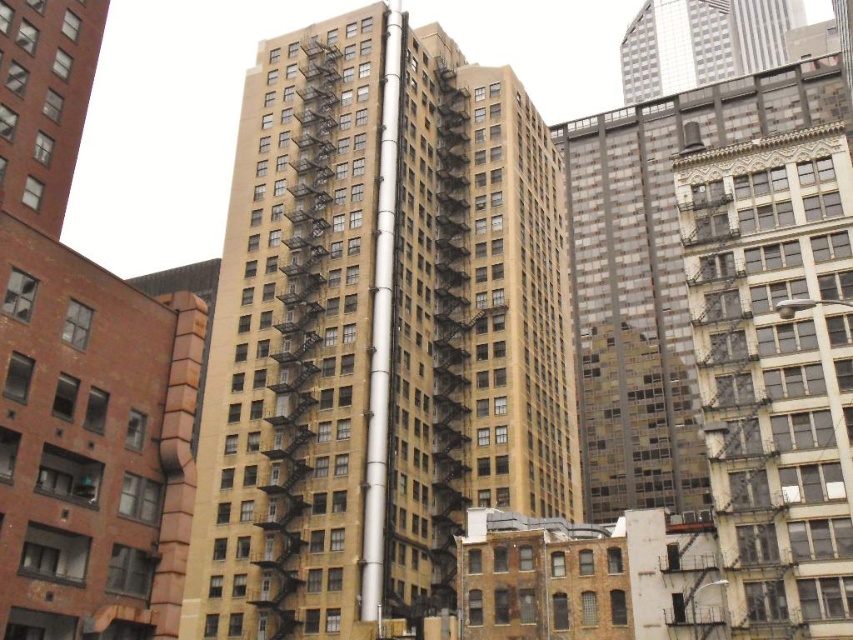
Between beige concrete building at center and silver metallic pole at center, which one has more height?

beige concrete building at center

Is point (234, 259) less distant than point (368, 449)?

No, (234, 259) is further to viewer.

Where is `beige concrete building at center`? This screenshot has height=640, width=853. beige concrete building at center is located at coordinates (376, 332).

Can you confirm if silver metallic skyscraper at upper right is shorter than silver metallic pole at center?

Yes.

What do you see at coordinates (701, 42) in the screenshot?
I see `silver metallic skyscraper at upper right` at bounding box center [701, 42].

Locate an element on the screen. The image size is (853, 640). silver metallic skyscraper at upper right is located at coordinates (701, 42).

Who is higher up, beige concrete building at center or silver metallic skyscraper at upper right?

silver metallic skyscraper at upper right is above.

Where is `beige concrete building at center`? The height and width of the screenshot is (640, 853). beige concrete building at center is located at coordinates (376, 332).